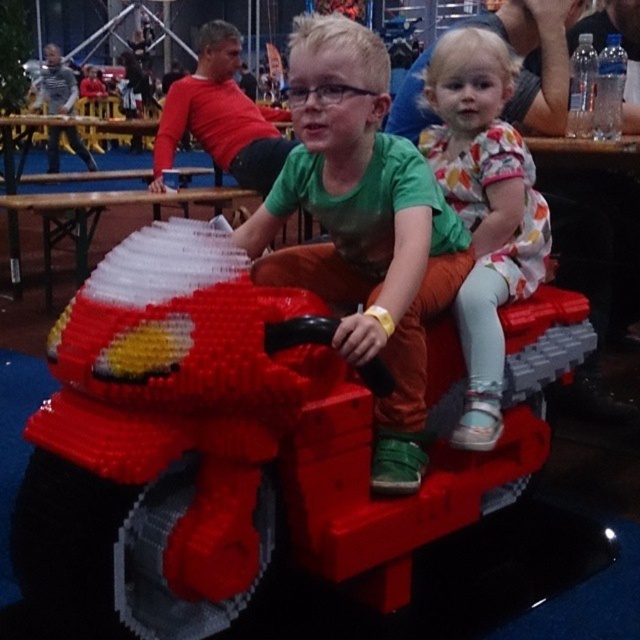
Question: Which object is the farthest from the matte plastic boy at center?

Choices:
 (A) floral dress at center
 (B) red plastic motorcycle at center

Answer: (B)

Question: Can you confirm if red plastic motorcycle at center is smaller than floral dress at center?

Choices:
 (A) yes
 (B) no

Answer: (B)

Question: Which point is farther to the camera?

Choices:
 (A) (499, 179)
 (B) (424, 314)

Answer: (A)

Question: Which of the following is the closest to the observer?

Choices:
 (A) red plastic motorcycle at center
 (B) matte plastic boy at center

Answer: (A)

Question: Does red plastic motorcycle at center have a larger size compared to matte plastic boy at center?

Choices:
 (A) yes
 (B) no

Answer: (A)

Question: Can you confirm if red plastic motorcycle at center is positioned to the right of matte plastic boy at center?

Choices:
 (A) yes
 (B) no

Answer: (B)